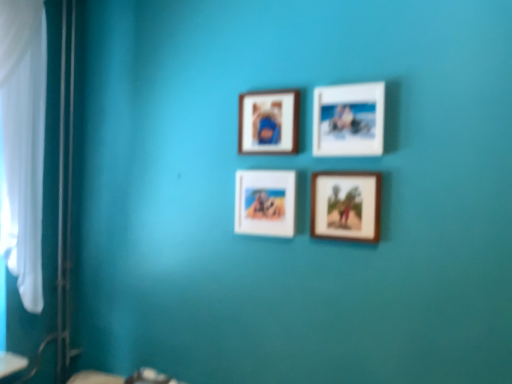
Question: Do you think wooden photo frame at lower right, which is the 3th picture frame in left-to-right order, is within matte wooden picture frame at center, which ranks as the first picture frame in left-to-right order, or outside of it?

Choices:
 (A) outside
 (B) inside

Answer: (A)

Question: Is wooden photo frame at lower right, the 2th picture frame when ordered from right to left, to the left or to the right of matte wooden picture frame at center, which ranks as the first picture frame in left-to-right order, in the image?

Choices:
 (A) left
 (B) right

Answer: (B)

Question: Which of these objects is positioned farthest from the matte wooden picture frame at center, which ranks as the first picture frame in left-to-right order?

Choices:
 (A) white matte picture frame at upper center, which is the 1th picture frame from right to left
 (B) wooden frame at upper center, the second picture frame positioned from the left
 (C) wooden photo frame at lower right, which is the 3th picture frame in left-to-right order

Answer: (A)

Question: Estimate the real-world distances between objects in this image. Which object is closer to the wooden photo frame at lower right, the 2th picture frame when ordered from right to left?

Choices:
 (A) matte wooden picture frame at center, which ranks as the 4th picture frame in right-to-left order
 (B) white matte picture frame at upper center, arranged as the fourth picture frame when viewed from the left
 (C) wooden frame at upper center, arranged as the 3th picture frame when viewed from the right

Answer: (B)